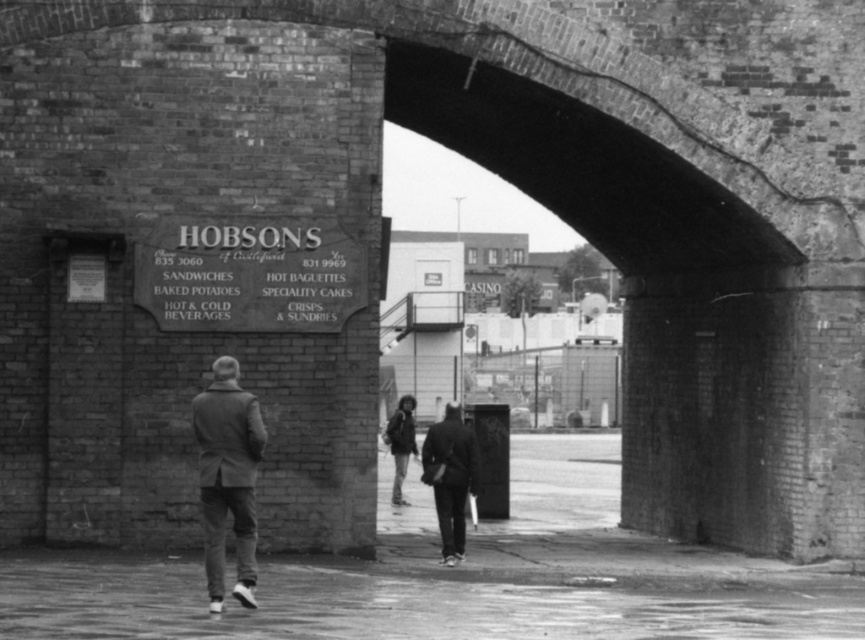
Question: Estimate the real-world distances between objects in this image. Which object is farther from the dark gray fabric jacket at center?

Choices:
 (A) dark gray wool coat at center
 (B) dark fabric jacket at center

Answer: (A)

Question: Can you confirm if dark gray wool coat at center is positioned to the right of dark fabric jacket at center?

Choices:
 (A) yes
 (B) no

Answer: (B)

Question: Is dark fabric jacket at center bigger than dark gray fabric jacket at center?

Choices:
 (A) yes
 (B) no

Answer: (A)

Question: Among these objects, which one is farthest from the camera?

Choices:
 (A) dark gray wool coat at center
 (B) dark fabric jacket at center

Answer: (B)

Question: Is dark gray wool coat at center above dark fabric jacket at center?

Choices:
 (A) yes
 (B) no

Answer: (A)

Question: Which object is closer to the camera taking this photo?

Choices:
 (A) dark gray wool coat at center
 (B) dark fabric jacket at center
 (C) dark gray fabric jacket at center

Answer: (A)